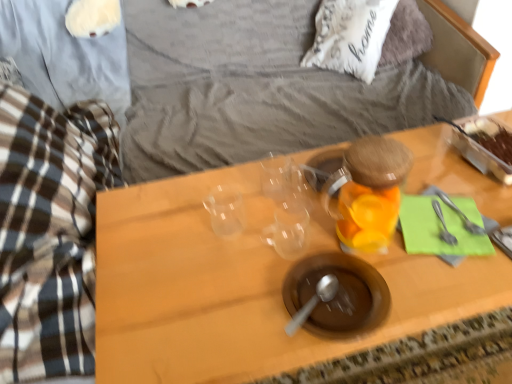
This screenshot has width=512, height=384. What are the coordinates of `free space between brown matte bowl at center and transparent glass jar at center-right` in the screenshot? It's located at (348, 263).